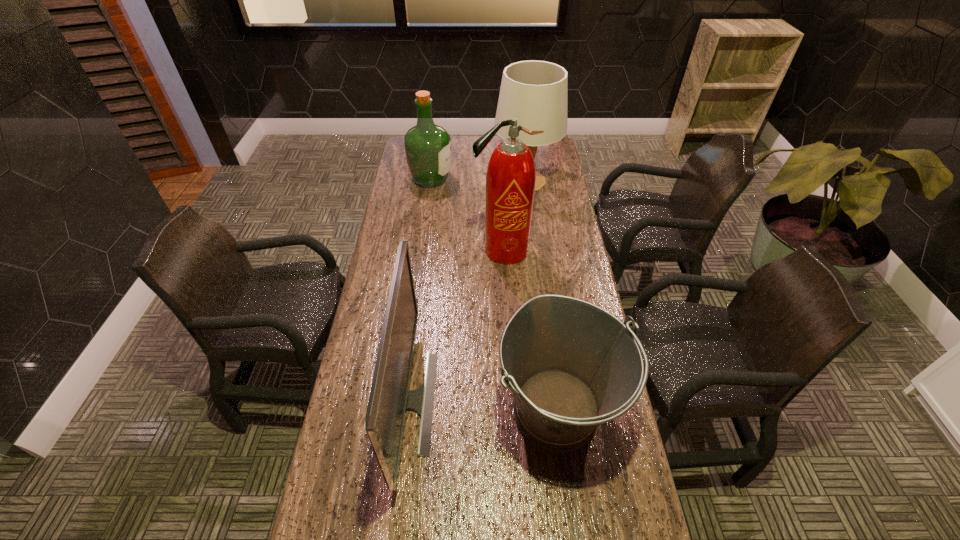
Find the location of `unoccupied position between the shortest object and the liquor`. unoccupied position between the shortest object and the liquor is located at coordinates (494, 295).

Locate an element on the screen. This screenshot has width=960, height=540. free space between the monitor and the liquor is located at coordinates (418, 291).

Find the location of `object that stands as the second closest to the third nearest object`. object that stands as the second closest to the third nearest object is located at coordinates pyautogui.click(x=390, y=397).

This screenshot has width=960, height=540. In order to click on object that is the third nearest to the shortest object in this screenshot , I will do `click(534, 92)`.

Where is `free region that satisfies the following two spatial constraints: 1. on the back side of the table lamp; 2. on the front-facing side of the liquor`? The height and width of the screenshot is (540, 960). free region that satisfies the following two spatial constraints: 1. on the back side of the table lamp; 2. on the front-facing side of the liquor is located at coordinates (526, 180).

The width and height of the screenshot is (960, 540). What are the coordinates of `free space that satisfies the following two spatial constraints: 1. on the back side of the bucket; 2. on the front-facing side of the liquor` in the screenshot? It's located at (527, 180).

Locate an element on the screen. blank area in the image that satisfies the following two spatial constraints: 1. on the front-facing side of the bucket; 2. on the right side of the liquor is located at coordinates pyautogui.click(x=399, y=410).

Locate an element on the screen. vacant region that satisfies the following two spatial constraints: 1. on the front-facing side of the bucket; 2. on the left side of the liquor is located at coordinates (399, 410).

Locate an element on the screen. This screenshot has height=540, width=960. free region that satisfies the following two spatial constraints: 1. on the screen side of the monitor; 2. on the left side of the shortest object is located at coordinates (403, 410).

The width and height of the screenshot is (960, 540). I want to click on vacant space that satisfies the following two spatial constraints: 1. on the back side of the shortest object; 2. on the front-facing side of the liquor, so click(x=527, y=180).